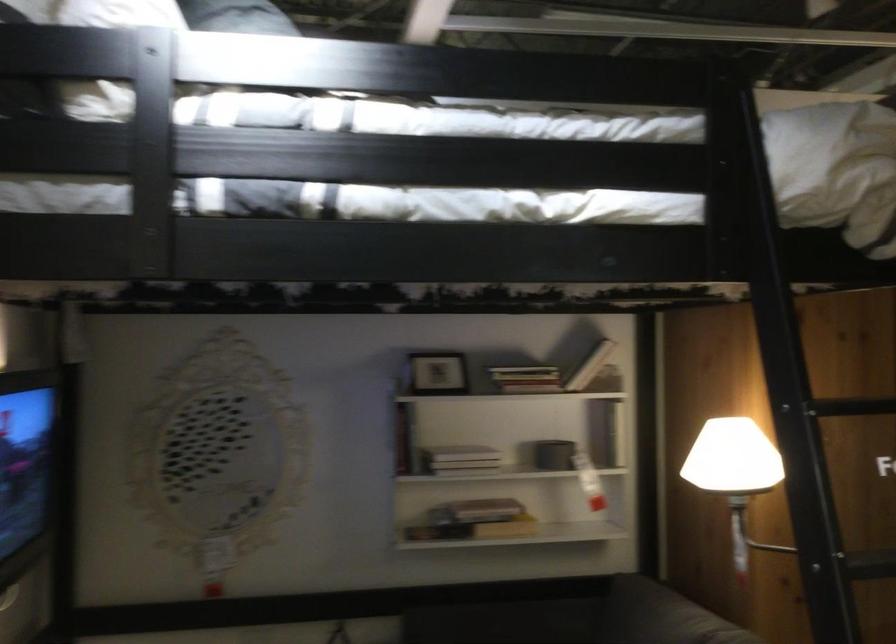
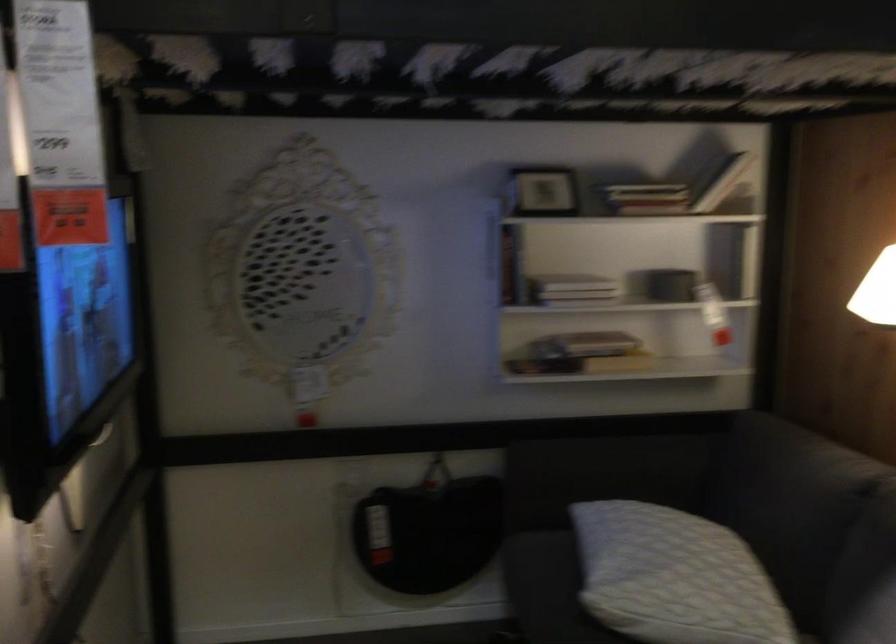
In a continuous first-person perspective shot, in which direction is the camera moving?

The movement direction of the cameraman is left, forward.